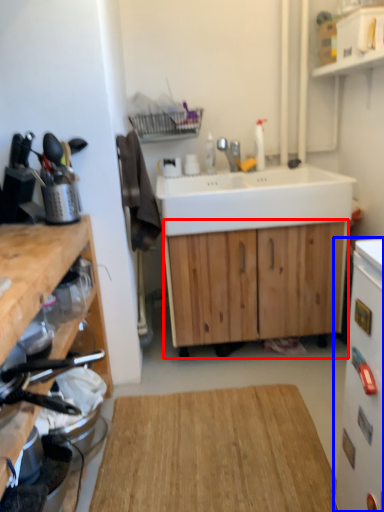
Question: Which of the following is the farthest to the observer, cabinetry (highlighted by a red box) or appliance (highlighted by a blue box)?

Choices:
 (A) cabinetry
 (B) appliance

Answer: (A)